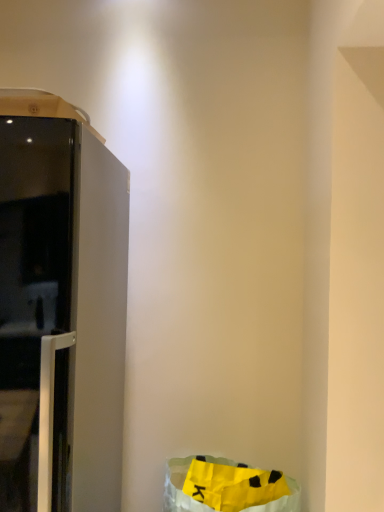
Question: From the image's perspective, is satin white refrigerator at left located above or below yellow paper bag at lower right?

Choices:
 (A) below
 (B) above

Answer: (B)

Question: Considering the positions of satin white refrigerator at left and yellow paper bag at lower right in the image, is satin white refrigerator at left taller or shorter than yellow paper bag at lower right?

Choices:
 (A) short
 (B) tall

Answer: (B)

Question: Is satin white refrigerator at left situated inside yellow paper bag at lower right or outside?

Choices:
 (A) outside
 (B) inside

Answer: (A)

Question: Looking at their shapes, would you say yellow paper bag at lower right is wider or thinner than satin white refrigerator at left?

Choices:
 (A) wide
 (B) thin

Answer: (B)

Question: Based on their positions, is yellow paper bag at lower right located to the left or right of satin white refrigerator at left?

Choices:
 (A) right
 (B) left

Answer: (A)

Question: Based on their sizes in the image, would you say yellow paper bag at lower right is bigger or smaller than satin white refrigerator at left?

Choices:
 (A) small
 (B) big

Answer: (A)

Question: Considering their positions, is yellow paper bag at lower right located in front of or behind satin white refrigerator at left?

Choices:
 (A) behind
 (B) front

Answer: (A)